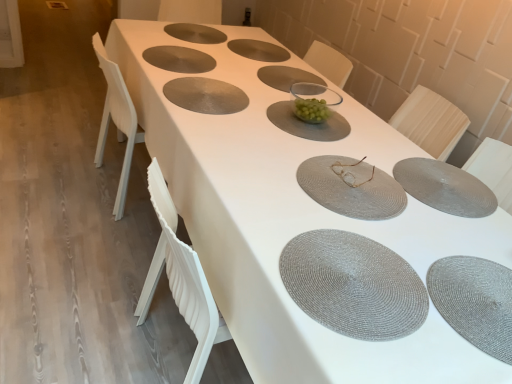
You are a GUI agent. You are given a task and a screenshot of the screen. Output one action in this format:
    pyautogui.click(x=<x>, y=<y>)
    Task: Click on the vacant area on top of gray woven placemat at center (from a real-world perspective)
    The image size is (512, 384).
    Given the screenshot: What is the action you would take?
    pyautogui.click(x=350, y=270)